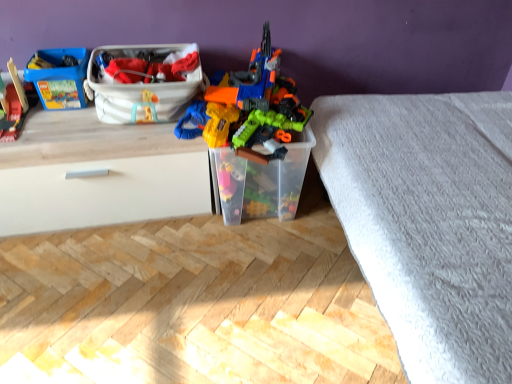
Question: From the image's perspective, is white matte drawer at left located above or below wooden train at left, which is counted as the first toy, starting from the left?

Choices:
 (A) above
 (B) below

Answer: (B)

Question: Considering the positions of white matte drawer at left and wooden train at left, the 2th toy in the right-to-left sequence, in the image, is white matte drawer at left wider or thinner than wooden train at left, the 2th toy in the right-to-left sequence,?

Choices:
 (A) wide
 (B) thin

Answer: (A)

Question: Estimate the real-world distances between objects in this image. Which object is closer to the wooden train at left, which is counted as the first toy, starting from the left?

Choices:
 (A) matte plastic lego box at upper left, which appears as the third storage box when viewed from the right
 (B) white textured bed frame at lower right
 (C) translucent plastic toy at center, which is the second toy in left-to-right order
 (D) white plastic storage box at upper center, marked as the 2th storage box in a right-to-left arrangement
 (E) white matte drawer at left

Answer: (A)

Question: Considering the real-world distances, which object is farthest from the transparent plastic container at center, which appears as the 1th storage box when viewed from the right?

Choices:
 (A) white matte drawer at left
 (B) white plastic storage box at upper center, which ranks as the 2th storage box in left-to-right order
 (C) translucent plastic toy at center, the first toy viewed from the right
 (D) matte plastic lego box at upper left, placed as the 1th storage box when sorted from left to right
 (E) white textured bed frame at lower right

Answer: (D)